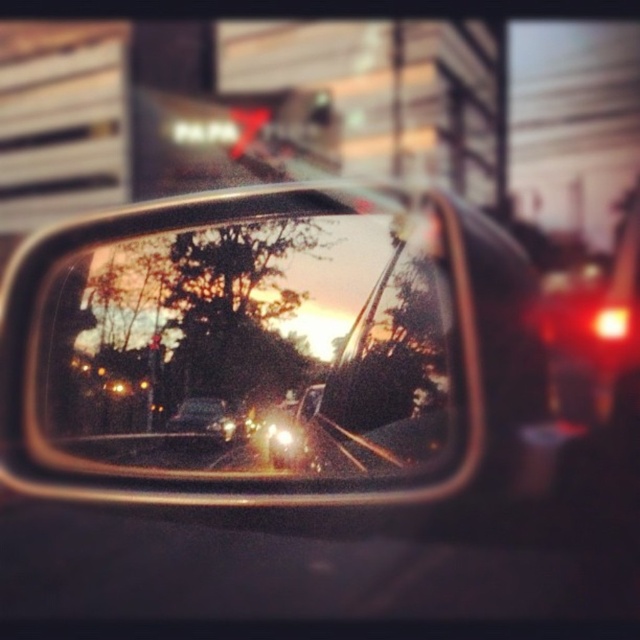
You are driving a car and looking at the side mirror. You see the metallic silver train track at center and the matte black car at center in the reflection. Which object in the reflection takes up more space?

The metallic silver train track at center takes up more space in the reflection because it is bigger than the matte black car at center.

You are driving a car and want to check your blind spot. You look at the metallic reflective mirror at center and the matte black car at center. Which object will allow you to see vehicles behind you?

The metallic reflective mirror at center will allow you to see vehicles behind you because it is a rearview mirror designed for that purpose, while the matte black car at center is your own vehicle and cannot reflect images.

You are a driver adjusting your side mirror to ensure proper visibility. Given that the metallic reflective mirror at center is positioned at coordinates point 0.541, 0.377, does this placement align with the recommended position for optimal rearview visibility according to standard automotive guidelines?

The position of metallic reflective mirror at center at point (241, 346) is optimal for rearview visibility as it aligns with standard automotive guidelines which recommend positioning the mirror so that the horizon line is visible and the mirror is centered appropriately. However, individual adjustments may vary based on driver preference and vehicle design.